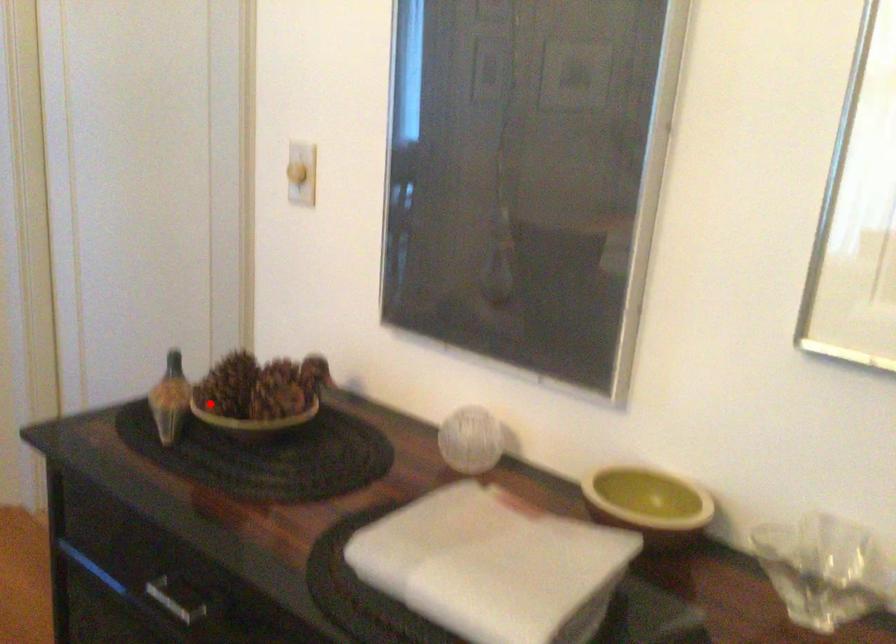
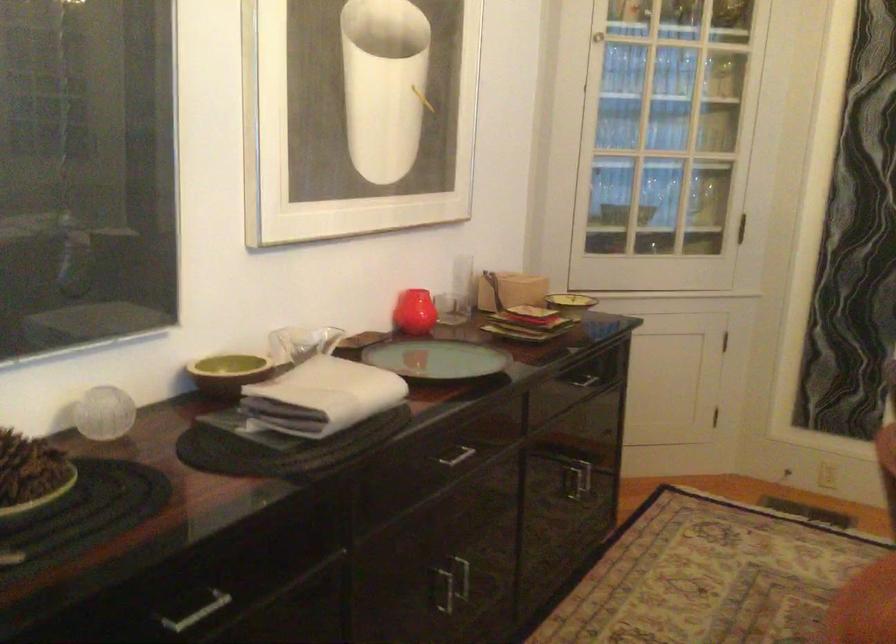
Locate, in the second image, the point that corresponds to the highlighted location in the first image.

(30, 475)